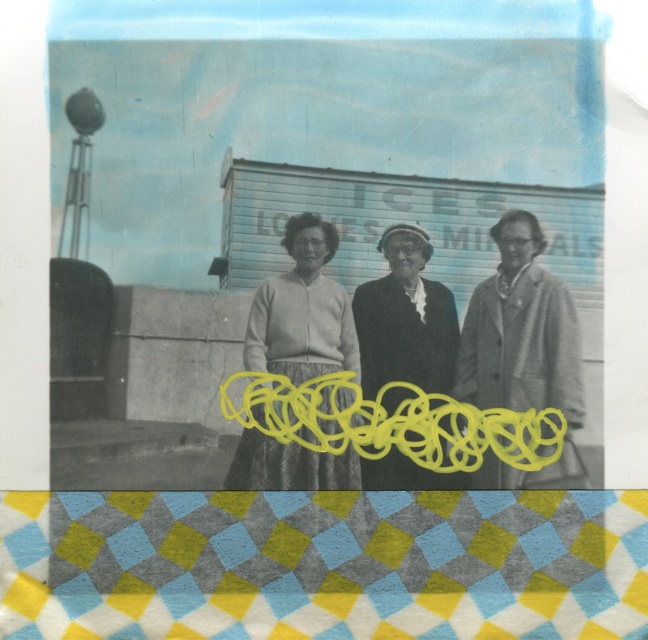
You are a photographer trying to determine if two people in the photo are standing close enough to shake hands. The two people are the one wearing the matte gray sweater at center and the one in the smooth black coat at center. Can they reach each other?

The distance between the matte gray sweater at center and the smooth black coat at center is 0.94 inches. Since this distance is less than the typical reach required for a handshake, they can likely shake hands.

You are an artist trying to recreate this vintage photograph. You notice two garments at the center of the image. Which one is smaller in size between the light gray wool coat at center and the knitted sweater at center?

The light gray wool coat at center is smaller than the knitted sweater at center.